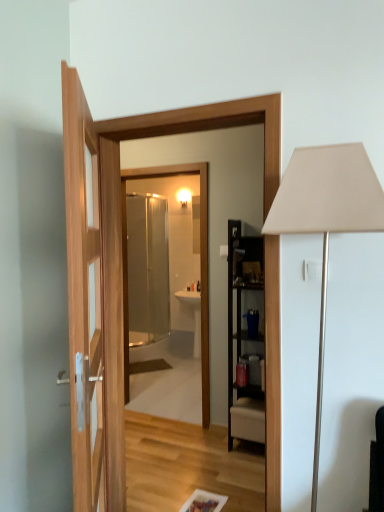
This screenshot has height=512, width=384. What are the coordinates of `vacant area that is in front of transparent glass mirror at center` in the screenshot? It's located at (158, 437).